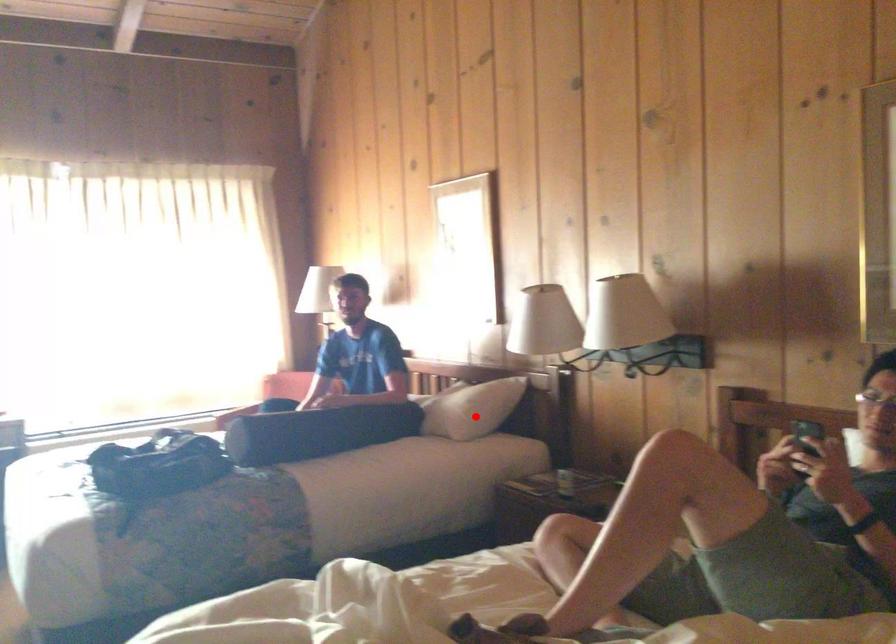
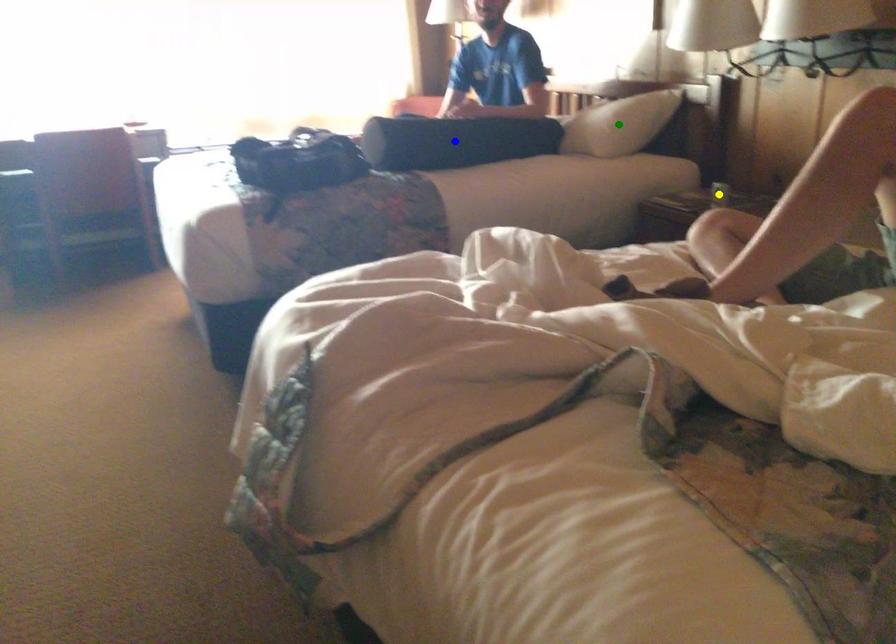
Question: I am providing you with two images of the same scene from different viewpoints. A red point is marked on the first image. You are given multiple points on the second image. Which point in image 2 is actually the same real-world point as the red point in image 1?

Choices:
 (A) yellow point
 (B) blue point
 (C) green point

Answer: (C)